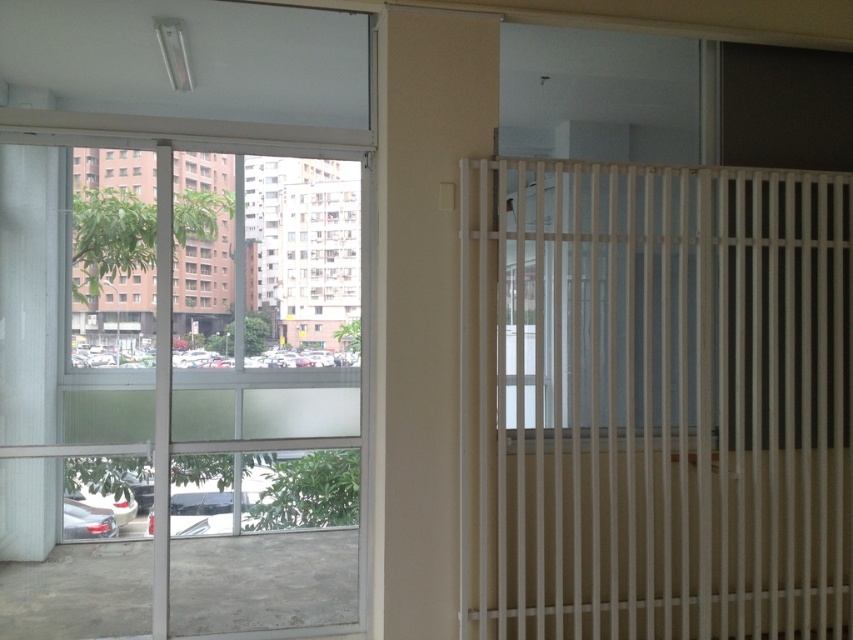
Question: Which point is closer to the camera taking this photo?

Choices:
 (A) (212, 252)
 (B) (537, 330)

Answer: (B)

Question: Which object appears closest to the camera in this image?

Choices:
 (A) transparent glass door at left
 (B) white wood radiator at upper right

Answer: (B)

Question: Is white wood radiator at upper right positioned at the back of transparent glass door at left?

Choices:
 (A) yes
 (B) no

Answer: (B)

Question: Is white wood radiator at upper right to the left of transparent glass door at left from the viewer's perspective?

Choices:
 (A) no
 (B) yes

Answer: (A)

Question: Is white wood radiator at upper right below transparent glass door at left?

Choices:
 (A) yes
 (B) no

Answer: (A)